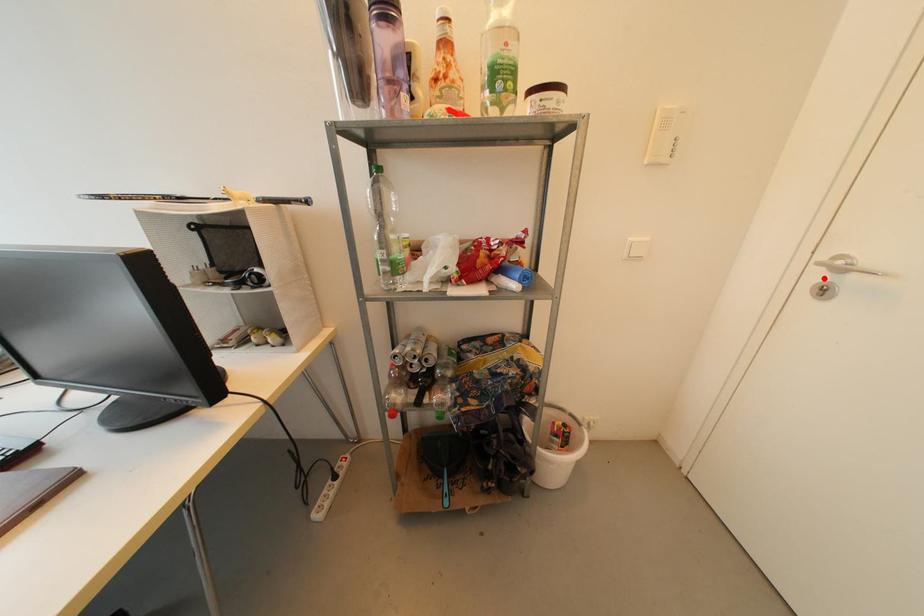
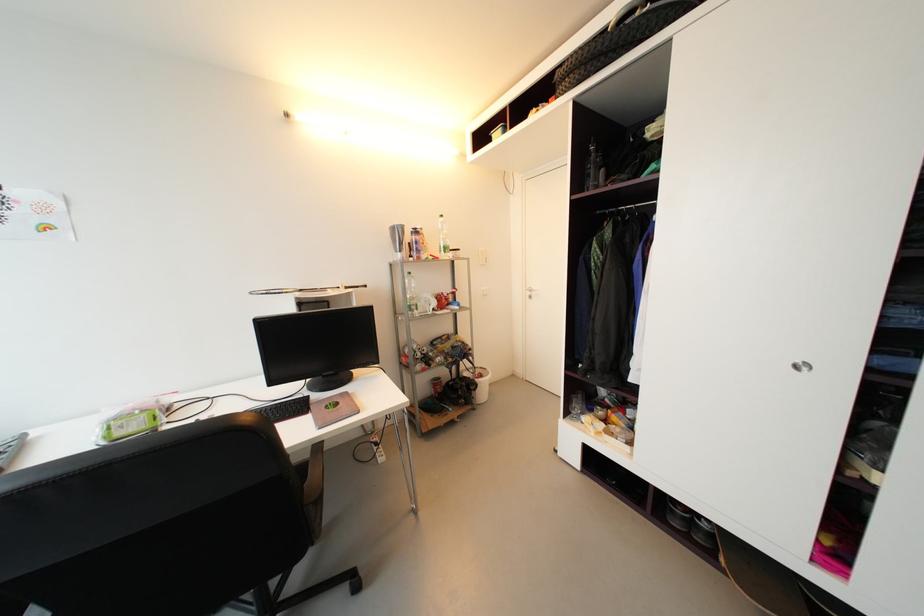
Question: I am providing you with two images of the same scene from different viewpoints. A red point is marked on the first image. Can you still see the location of the red point in image 2?

Choices:
 (A) Yes
 (B) No

Answer: (A)